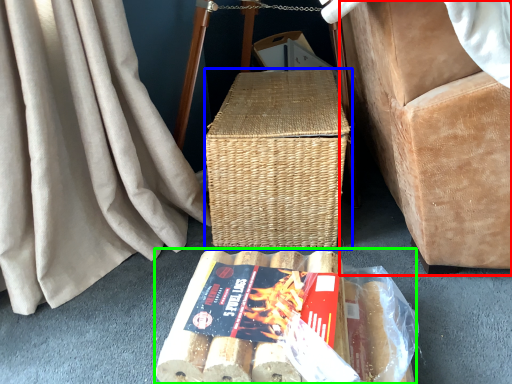
Question: Based on their relative distances, which object is nearer to furniture (highlighted by a red box)? Choose from picnic basket (highlighted by a blue box) and food (highlighted by a green box).

Choices:
 (A) picnic basket
 (B) food

Answer: (A)